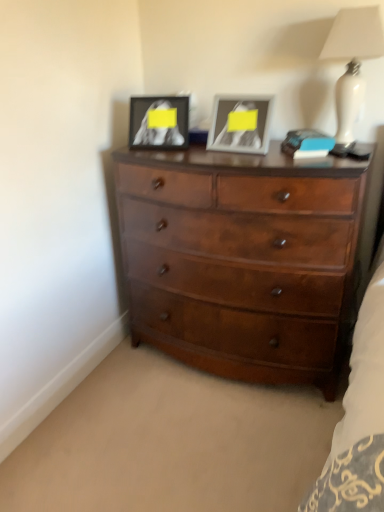
Question: Is matte black picture frame at upper center, placed as the second picture frame when sorted from right to left, touching white glossy lamp at upper right?

Choices:
 (A) yes
 (B) no

Answer: (B)

Question: Does matte black picture frame at upper center, the 1th picture frame viewed from the left, come in front of white glossy lamp at upper right?

Choices:
 (A) no
 (B) yes

Answer: (A)

Question: Does matte black picture frame at upper center, placed as the second picture frame when sorted from right to left, lie behind white glossy lamp at upper right?

Choices:
 (A) no
 (B) yes

Answer: (B)

Question: Is matte black picture frame at upper center, the 1th picture frame viewed from the left, smaller than white glossy lamp at upper right?

Choices:
 (A) no
 (B) yes

Answer: (B)

Question: Is matte black picture frame at upper center, the 1th picture frame viewed from the left, facing towards white glossy lamp at upper right?

Choices:
 (A) no
 (B) yes

Answer: (A)

Question: Looking at the image, does shiny brown wooden chest of drawers at center seem bigger or smaller compared to white glossy lamp at upper right?

Choices:
 (A) big
 (B) small

Answer: (A)

Question: In terms of height, does shiny brown wooden chest of drawers at center look taller or shorter compared to white glossy lamp at upper right?

Choices:
 (A) tall
 (B) short

Answer: (A)

Question: Considering their positions, is shiny brown wooden chest of drawers at center located in front of or behind white glossy lamp at upper right?

Choices:
 (A) front
 (B) behind

Answer: (A)

Question: Considering the positions of point (342, 348) and point (354, 38), is point (342, 348) closer or farther from the camera than point (354, 38)?

Choices:
 (A) farther
 (B) closer

Answer: (A)

Question: Considering the positions of metallic silver picture frame at upper center, arranged as the first picture frame when viewed from the right, and blue matte book at upper right in the image, is metallic silver picture frame at upper center, arranged as the first picture frame when viewed from the right, taller or shorter than blue matte book at upper right?

Choices:
 (A) short
 (B) tall

Answer: (B)

Question: From the image's perspective, is metallic silver picture frame at upper center, the second picture frame viewed from the left, located above or below blue matte book at upper right?

Choices:
 (A) below
 (B) above

Answer: (B)

Question: Would you say metallic silver picture frame at upper center, the second picture frame viewed from the left, is to the left or to the right of blue matte book at upper right in the picture?

Choices:
 (A) left
 (B) right

Answer: (A)

Question: From a real-world perspective, is metallic silver picture frame at upper center, arranged as the first picture frame when viewed from the right, positioned above or below blue matte book at upper right?

Choices:
 (A) above
 (B) below

Answer: (A)

Question: From the image's perspective, is white glossy lamp at upper right positioned above or below metallic silver picture frame at upper center, arranged as the first picture frame when viewed from the right?

Choices:
 (A) above
 (B) below

Answer: (A)

Question: Does point (339, 109) appear closer or farther from the camera than point (236, 120)?

Choices:
 (A) closer
 (B) farther

Answer: (B)